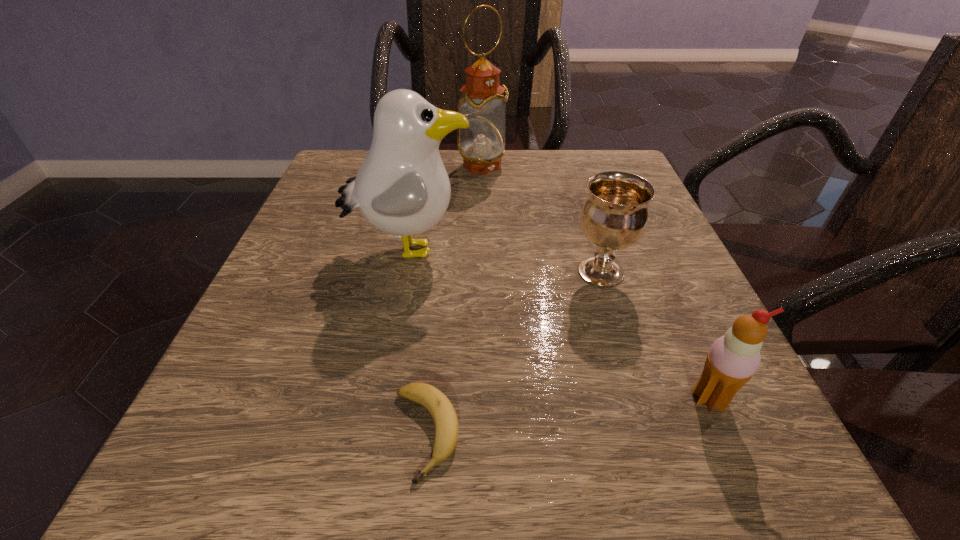
I want to click on object that ranks as the third closest to the chalice, so click(x=444, y=415).

Select which object is the closest to the farthest object. Please provide its 2D coordinates. Your answer should be formatted as a tuple, i.e. [(x, y)], where the tuple contains the x and y coordinates of a point satisfying the conditions above.

[(402, 188)]

Locate an element on the screen. vacant position in the image that satisfies the following two spatial constraints: 1. on the back side of the banana; 2. on the right side of the second object from right to left is located at coordinates (442, 272).

Find the location of `free space in the image that satisfies the following two spatial constraints: 1. on the beak of the second tallest object; 2. on the back side of the banana`. free space in the image that satisfies the following two spatial constraints: 1. on the beak of the second tallest object; 2. on the back side of the banana is located at coordinates (375, 434).

This screenshot has height=540, width=960. In order to click on vacant space that satisfies the following two spatial constraints: 1. on the back side of the chalice; 2. on the beak of the gull in this screenshot , I will do `click(593, 249)`.